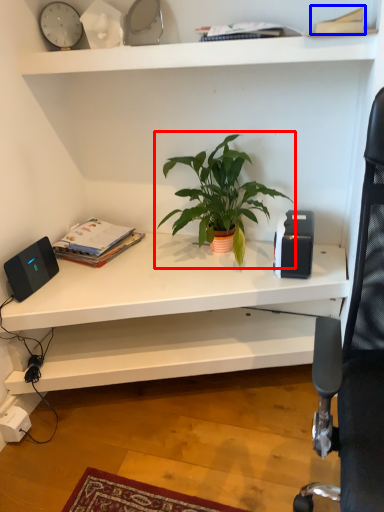
Question: Among these objects, which one is nearest to the camera, houseplant (highlighted by a red box) or paperback book (highlighted by a blue box)?

Choices:
 (A) houseplant
 (B) paperback book

Answer: (B)